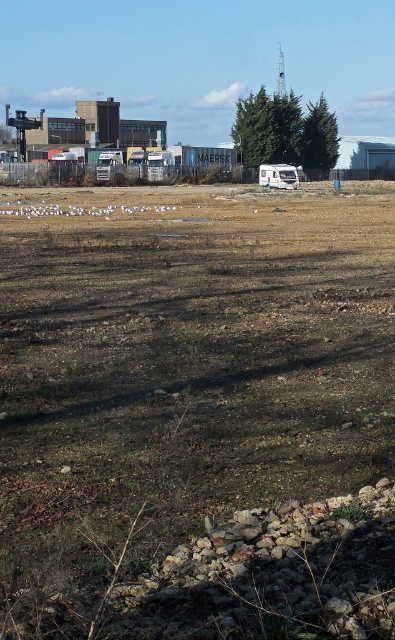
You are standing at point (327, 108) and want to walk to the white RV parked in the midground. The distance between you and the RV is 323.94 feet. If your walking speed is 3 miles per hour, how many minutes will it take you to reach the RV?

The distance between you and the white RV is 323.94 feet. Converting feet to miles, 323.94 feet is approximately 0.0613 miles. At a walking speed of 3 miles per hour, the time required is distance divided by speed, so 0.0613 miles divided by 3 mph equals approximately 0.0204 hours. Converting hours to minutes by multiplying by 60 gives roughly 1.22 minutes. Therefore, it will take approximately 1.22 minutes to reach the RV.

You are a drone operator trying to capture aerial footage of the green textured tree at upper center and the white plastic camper at center. Which object will appear wider in the footage?

The green textured tree at upper center will appear wider in the footage since its width is larger than that of the white plastic camper at center.

You are a delivery driver who needs to park your truck in the open field. You see the brown soil at center and the white plastic camper at center. Which area is more suitable for parking your truck?

The brown soil at center has a larger size compared to the white plastic camper at center, so the brown soil at center is more suitable for parking the truck as it provides a wider space.